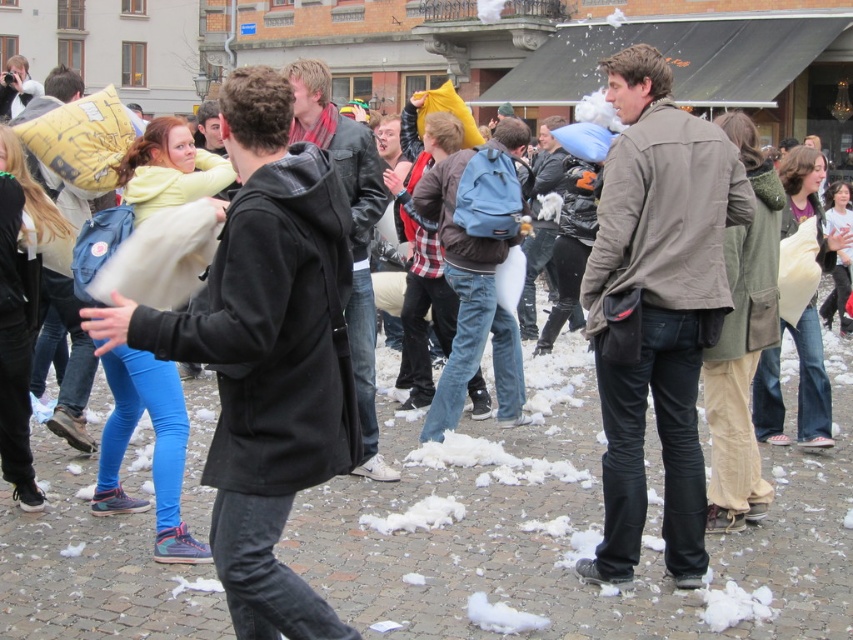
Question: Can you confirm if black matte jacket at center is positioned to the left of matte yellow pillow at left?

Choices:
 (A) yes
 (B) no

Answer: (B)

Question: Which object is farther from the camera taking this photo?

Choices:
 (A) black leather jacket at center
 (B) dark brown leather jacket at center
 (C) khaki cotton jacket at center

Answer: (B)

Question: Which of these objects is positioned farthest from the black matte jacket at center?

Choices:
 (A) dark brown leather jacket at center
 (B) matte yellow pillow at left
 (C) khaki cotton jacket at center
 (D) black leather jacket at center

Answer: (A)

Question: Can you confirm if black matte jacket at center is smaller than khaki cotton jacket at center?

Choices:
 (A) no
 (B) yes

Answer: (A)

Question: Based on their relative distances, which object is nearer to the matte yellow pillow at left?

Choices:
 (A) black matte jacket at center
 (B) khaki cotton jacket at center
 (C) dark brown leather jacket at center
 (D) black leather jacket at center

Answer: (D)

Question: Can you confirm if black matte jacket at center is positioned to the left of khaki cotton jacket at center?

Choices:
 (A) no
 (B) yes

Answer: (B)